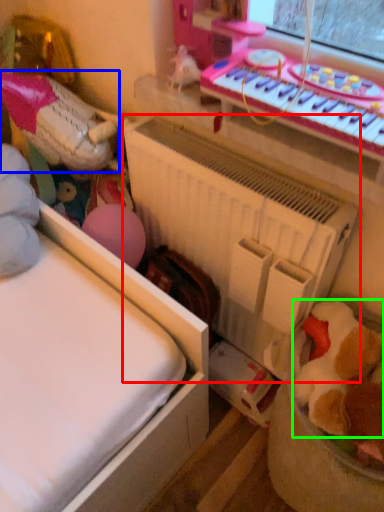
Question: Considering the real-world distances, which object is farthest from radiator (highlighted by a red box)? toy (highlighted by a blue box) or toy (highlighted by a green box)?

Choices:
 (A) toy
 (B) toy

Answer: (A)